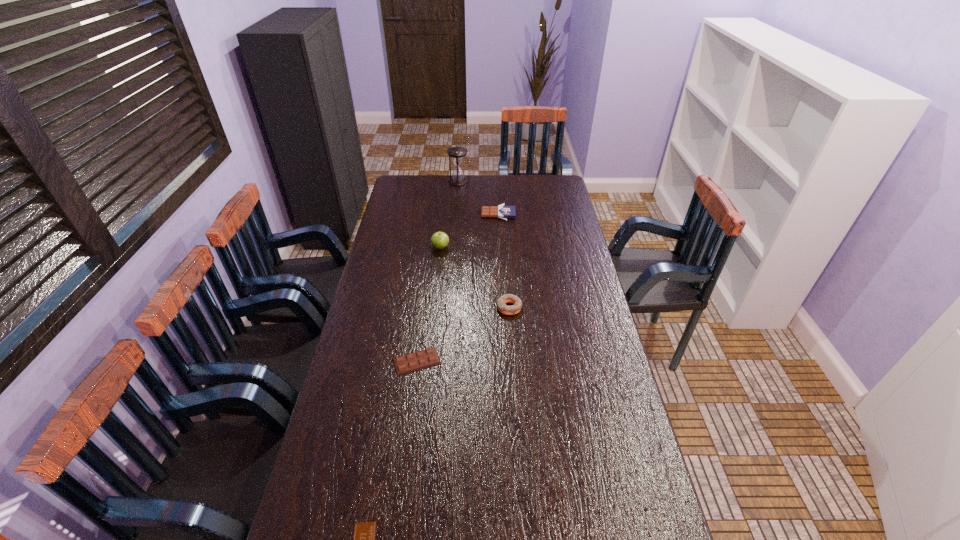
You are a GUI agent. You are given a task and a screenshot of the screen. Output one action in this format:
    pyautogui.click(x=<x>, y=<y>)
    Task: Click on the vacant space that satisfies the following two spatial constraints: 1. on the back side of the second farthest chocolate bar; 2. on the left side of the fourth shortest object
    The width and height of the screenshot is (960, 540).
    Given the screenshot: What is the action you would take?
    pyautogui.click(x=424, y=307)